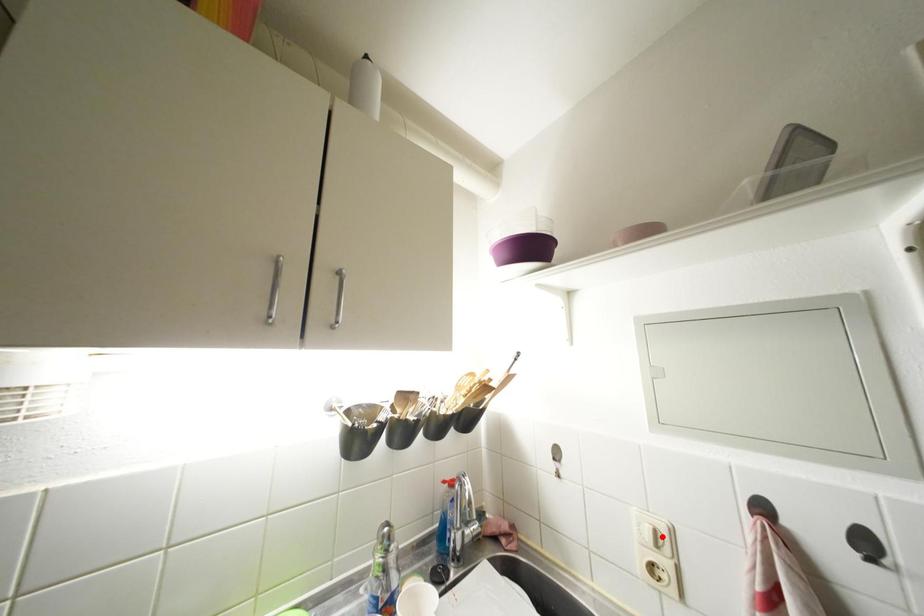
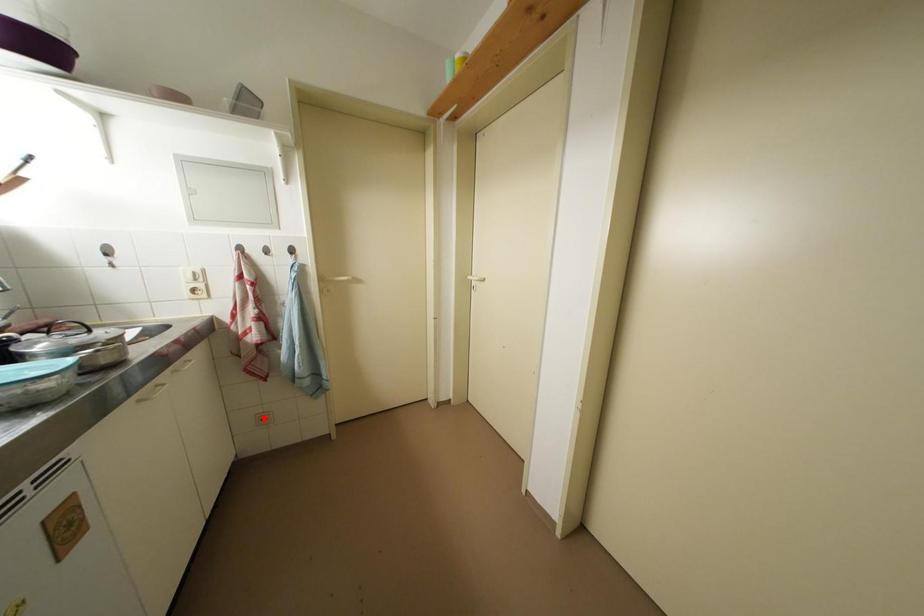
In the scene shown: I am providing you with two images of the same scene from different viewpoints. A red point is marked on the first image and another point is marked on the second image. Is the red point in image1 aligned with the point shown in image2?

No